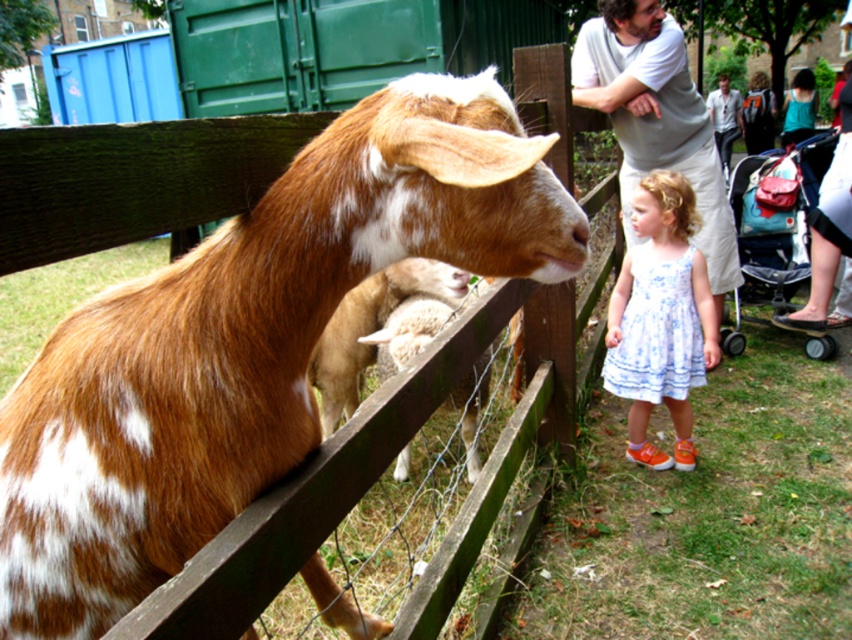
Can you confirm if brown speckled fur at left is shorter than white floral dress at center?

Correct, brown speckled fur at left is not as tall as white floral dress at center.

Is brown speckled fur at left positioned before white floral dress at center?

Yes, it is in front of white floral dress at center.

Between point (136, 566) and point (622, 266), which one is positioned in front?

Point (136, 566) is in front.

Identify the location of brown speckled fur at left. (246, 344).